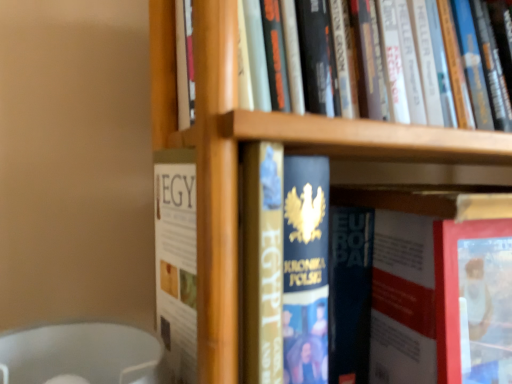
Question: Is hardcover book at center, placed as the fourth book when sorted from top to bottom, positioned with its back to hardcover book at center?

Choices:
 (A) yes
 (B) no

Answer: (B)

Question: Is hardcover book at center, placed as the fourth book when sorted from top to bottom, taller than hardcover book at center?

Choices:
 (A) no
 (B) yes

Answer: (B)

Question: Considering the relative sizes of hardcover book at center, which is the 1th book in bottom-to-top order, and hardcover book at center in the image provided, is hardcover book at center, which is the 1th book in bottom-to-top order, thinner than hardcover book at center?

Choices:
 (A) yes
 (B) no

Answer: (B)

Question: Is hardcover book at center inside hardcover book at center, which is the 1th book in bottom-to-top order?

Choices:
 (A) no
 (B) yes

Answer: (A)

Question: Is the depth of hardcover book at center, which is the 1th book in bottom-to-top order, less than that of hardcover book at center?

Choices:
 (A) yes
 (B) no

Answer: (B)

Question: Based on their sizes in the image, would you say hardcover books at upper center, which is counted as the first book, starting from the top, is bigger or smaller than hardcover book at center, placed as the fourth book when sorted from top to bottom?

Choices:
 (A) big
 (B) small

Answer: (A)

Question: In the image, is hardcover books at upper center, the fourth book from the bottom, on the left side or the right side of hardcover book at center, placed as the fourth book when sorted from top to bottom?

Choices:
 (A) left
 (B) right

Answer: (A)

Question: From the image's perspective, is hardcover books at upper center, the fourth book from the bottom, located above or below hardcover book at center, which is the 1th book in bottom-to-top order?

Choices:
 (A) below
 (B) above

Answer: (B)

Question: In the image, is hardcover books at upper center, which is counted as the first book, starting from the top, positioned in front of or behind hardcover book at center, placed as the fourth book when sorted from top to bottom?

Choices:
 (A) front
 (B) behind

Answer: (A)

Question: Is hardcover book at center wider or thinner than hardcover book at center, the third book from the bottom?

Choices:
 (A) wide
 (B) thin

Answer: (B)

Question: Considering the positions of point (489, 357) and point (480, 205), is point (489, 357) closer or farther from the camera than point (480, 205)?

Choices:
 (A) farther
 (B) closer

Answer: (A)

Question: From a real-world perspective, is hardcover book at center positioned above or below hardcover book at center, which appears as the second book when viewed from the top?

Choices:
 (A) above
 (B) below

Answer: (B)

Question: From the image's perspective, is hardcover book at center located above or below hardcover book at center, the third book from the bottom?

Choices:
 (A) below
 (B) above

Answer: (A)

Question: Considering the positions of point (248, 185) and point (275, 218), is point (248, 185) closer or farther from the camera than point (275, 218)?

Choices:
 (A) closer
 (B) farther

Answer: (A)

Question: Visually, is hardcover book at center, which appears as the second book when viewed from the top, positioned to the left or to the right of gold foil book at center, which appears as the second book when ordered from the bottom?

Choices:
 (A) right
 (B) left

Answer: (B)